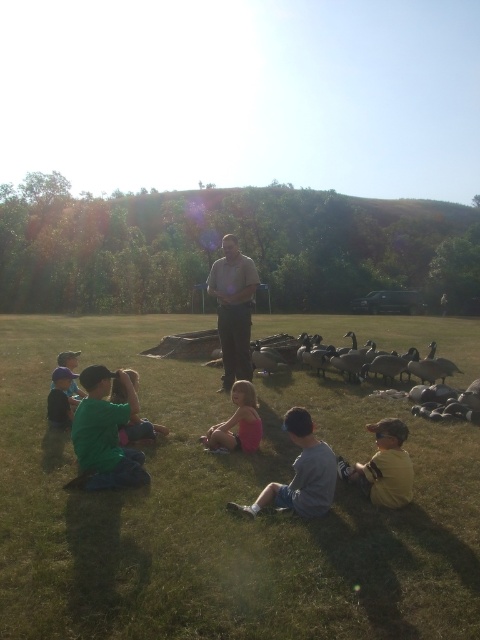
Does point (325, 484) come behind point (116, 380)?

That is False.

Does gray cotton shirt at center appear under green fabric shirt at lower left?

No.

Between point (307, 433) and point (154, 429), which one is positioned in front?

Point (307, 433)

Image resolution: width=480 pixels, height=640 pixels. I want to click on gray cotton shirt at center, so click(x=300, y=474).

Consider the image. Does green fabric shirt at lower left appear on the left side of matte green shirt at lower left?

Incorrect, green fabric shirt at lower left is not on the left side of matte green shirt at lower left.

Image resolution: width=480 pixels, height=640 pixels. What do you see at coordinates (140, 429) in the screenshot?
I see `green fabric shirt at lower left` at bounding box center [140, 429].

Find the location of a particular element. The height and width of the screenshot is (640, 480). green fabric shirt at lower left is located at coordinates (140, 429).

Locate an element on the screen. The image size is (480, 640). green matte shirt at lower left is located at coordinates (105, 433).

Is point (143, 458) positioned before point (134, 385)?

Yes.

I want to click on green matte shirt at lower left, so click(x=105, y=433).